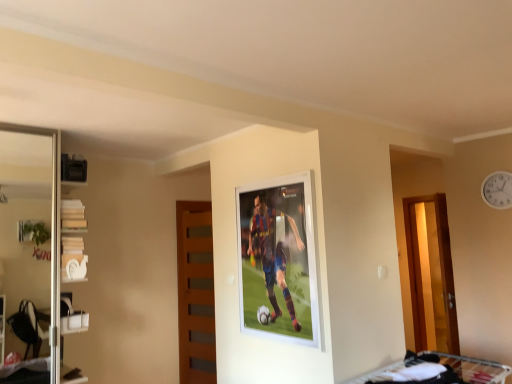
Question: From the image's perspective, does transparent glass screen door at left appear higher than wooden at center?

Choices:
 (A) no
 (B) yes

Answer: (B)

Question: Is transparent glass screen door at left further to the viewer compared to wooden at center?

Choices:
 (A) no
 (B) yes

Answer: (A)

Question: Is transparent glass screen door at left thinner than wooden at center?

Choices:
 (A) yes
 (B) no

Answer: (B)

Question: Are transparent glass screen door at left and wooden at center located far from each other?

Choices:
 (A) no
 (B) yes

Answer: (B)

Question: From the image's perspective, does transparent glass screen door at left appear lower than wooden at center?

Choices:
 (A) no
 (B) yes

Answer: (A)

Question: Is transparent glass screen door at left at the right side of wooden at center?

Choices:
 (A) yes
 (B) no

Answer: (B)

Question: Would you say white fabric bunk bed at lower right is part of white glossy shelves at left's contents?

Choices:
 (A) yes
 (B) no

Answer: (B)

Question: From a real-world perspective, is white glossy shelves at left on top of white fabric bunk bed at lower right?

Choices:
 (A) no
 (B) yes

Answer: (B)

Question: From a real-world perspective, is white glossy shelves at left positioned under white fabric bunk bed at lower right based on gravity?

Choices:
 (A) no
 (B) yes

Answer: (A)

Question: Considering the relative sizes of white glossy shelves at left and white fabric bunk bed at lower right in the image provided, is white glossy shelves at left taller than white fabric bunk bed at lower right?

Choices:
 (A) yes
 (B) no

Answer: (A)

Question: Does white glossy shelves at left have a smaller size compared to white fabric bunk bed at lower right?

Choices:
 (A) yes
 (B) no

Answer: (B)

Question: From the image's perspective, is white glossy shelves at left below white fabric bunk bed at lower right?

Choices:
 (A) yes
 (B) no

Answer: (B)

Question: Is wooden at center in front of white glossy shelves at left?

Choices:
 (A) yes
 (B) no

Answer: (B)